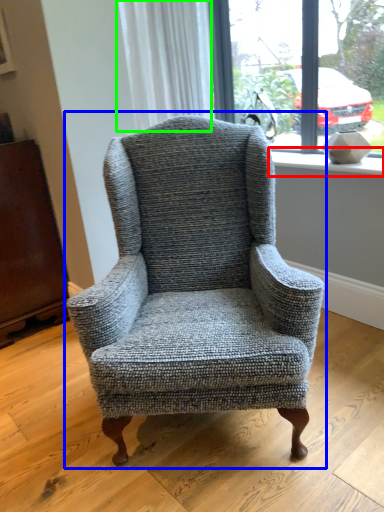
Question: Which object is the closest to the window sill (highlighted by a red box)? Choose among these: chair (highlighted by a blue box) or curtain (highlighted by a green box).

Choices:
 (A) chair
 (B) curtain

Answer: (B)